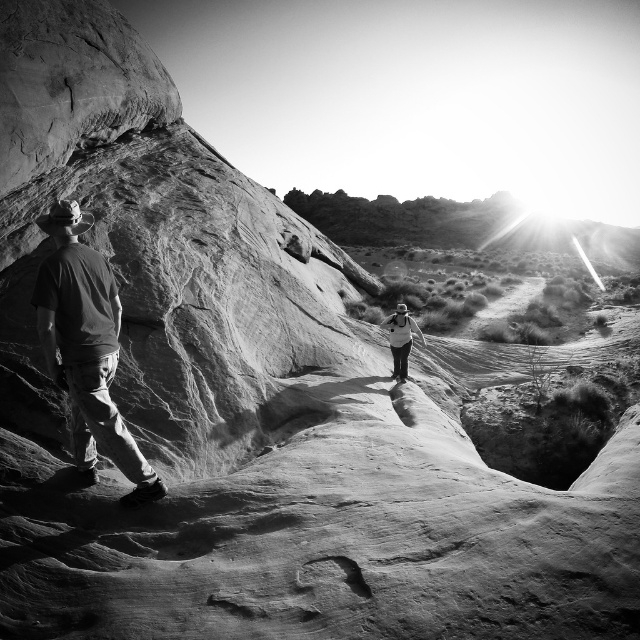
Is dark gray fabric shirt at left smaller than white fabric backpack at center?

Yes, dark gray fabric shirt at left is smaller than white fabric backpack at center.

Where is `dark gray fabric shirt at left`? This screenshot has height=640, width=640. dark gray fabric shirt at left is located at coordinates (86, 348).

Where is `dark gray fabric shirt at left`? This screenshot has height=640, width=640. dark gray fabric shirt at left is located at coordinates (86, 348).